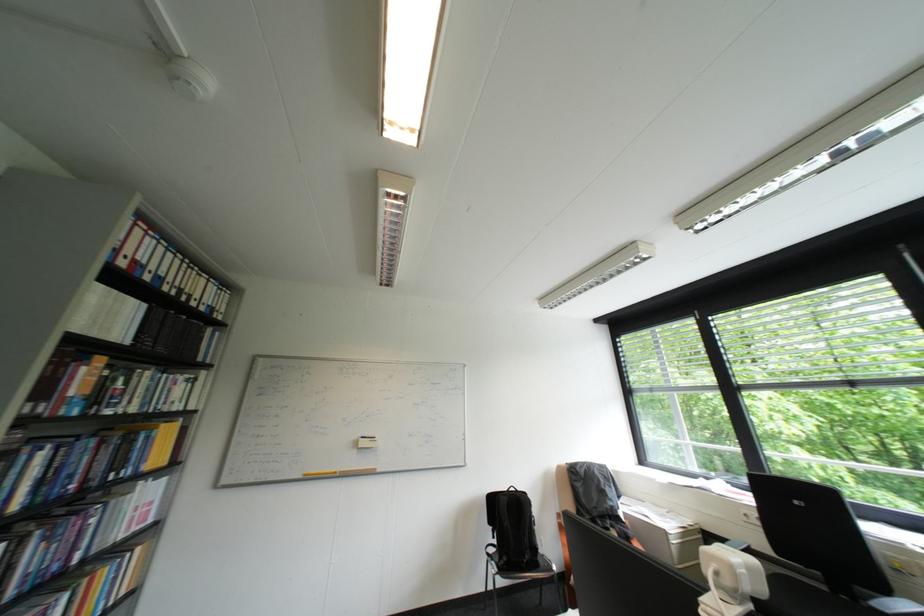
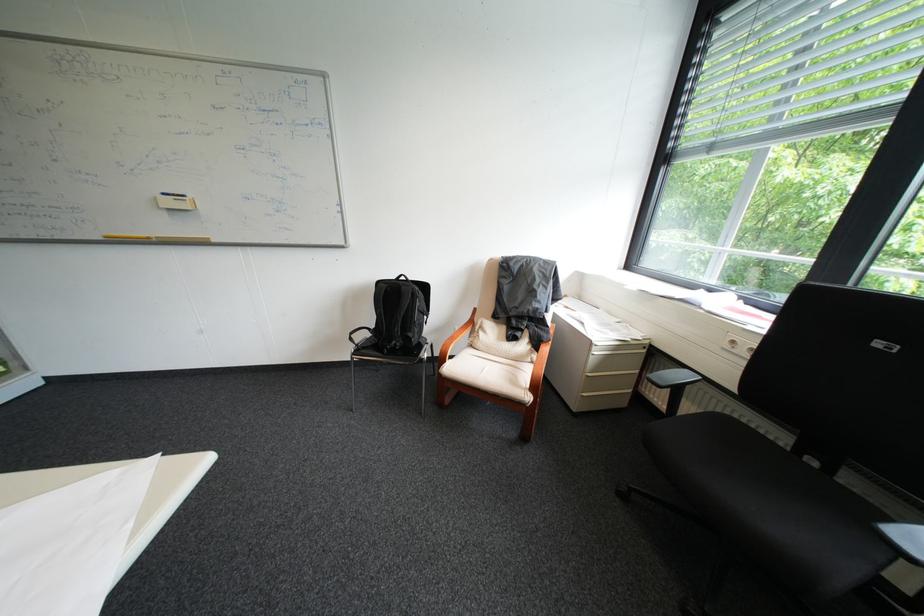
Locate, in the second image, the point that corresponds to point 373,438 in the first image.

(176, 195)